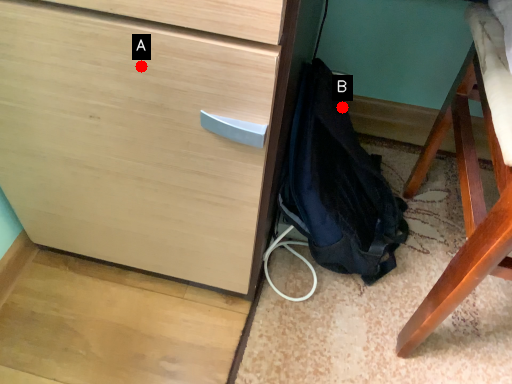
Question: Two points are circled on the image, labeled by A and B beside each circle. Which point is farther to the camera?

Choices:
 (A) A is further
 (B) B is further

Answer: (B)